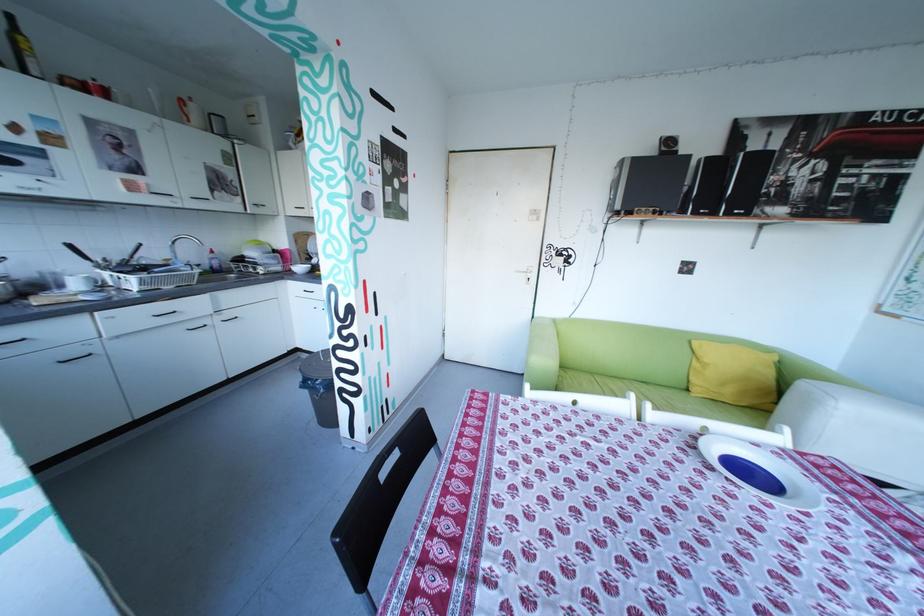
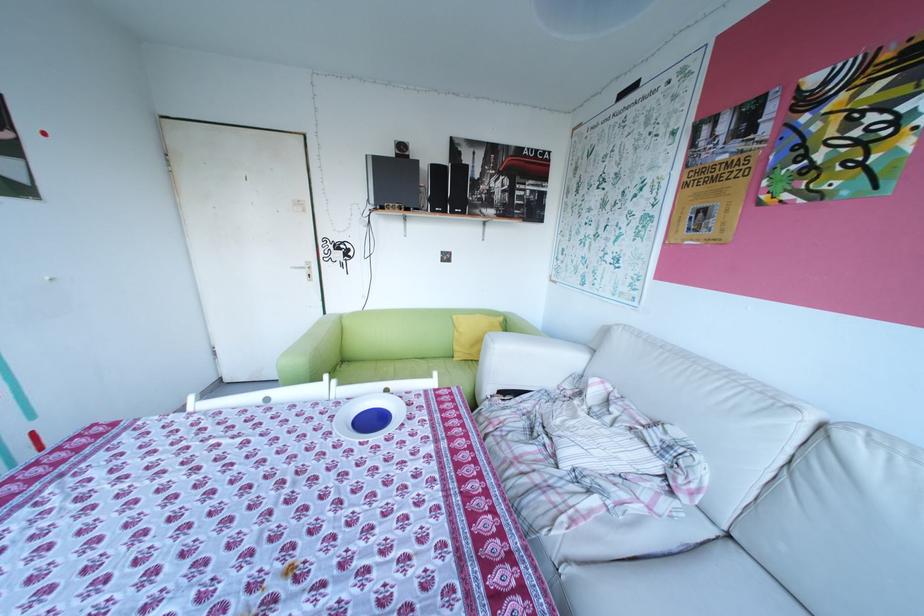
In the second image, find the point that corresponds to [708,213] in the first image.

(445, 209)